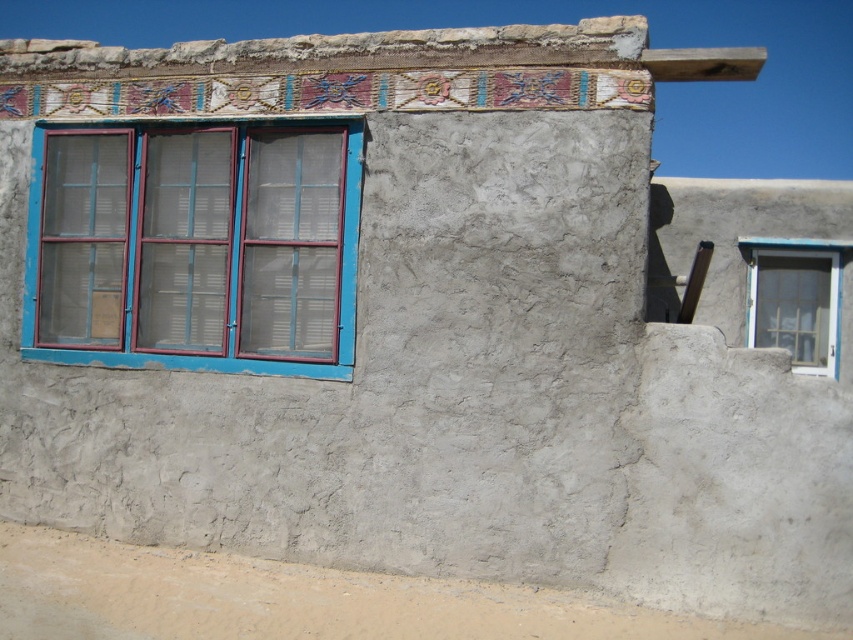
Can you confirm if blue painted wood window at left is positioned below white painted wood window at right?

No.

This screenshot has width=853, height=640. Describe the element at coordinates (194, 248) in the screenshot. I see `blue painted wood window at left` at that location.

Identify the location of blue painted wood window at left. (194, 248).